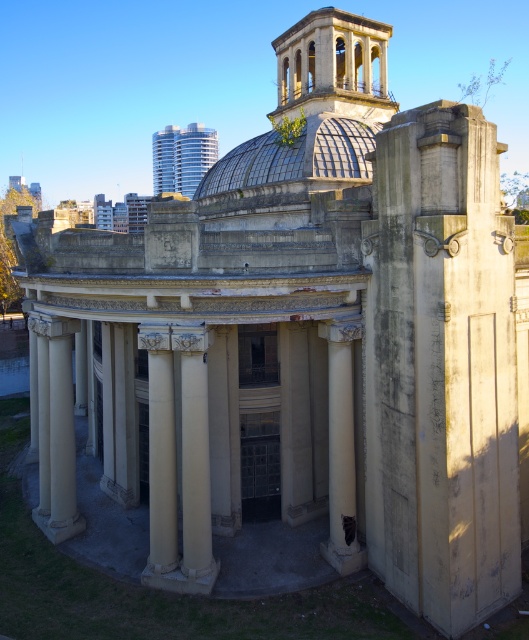
Consider the image. Is beige stone column at right to the right of matte glass dome at upper center from the viewer's perspective?

Correct, you'll find beige stone column at right to the right of matte glass dome at upper center.

In the scene shown: Can you confirm if beige stone column at right is wider than matte glass dome at upper center?

Incorrect, beige stone column at right's width does not surpass matte glass dome at upper center's.

Where is `beige stone column at right`? This screenshot has width=529, height=640. beige stone column at right is located at coordinates (442, 371).

Between point (417, 212) and point (344, 369), which one is positioned behind?

The point (344, 369) is more distant.

Who is more forward, [426,237] or [345,465]?

Positioned in front is point [426,237].

Where is `beige stone column at right`? beige stone column at right is located at coordinates (442, 371).

Who is lower down, matte glass dome at upper center or white stone column at center?

white stone column at center

Locate an element on the screen. matte glass dome at upper center is located at coordinates (316, 106).